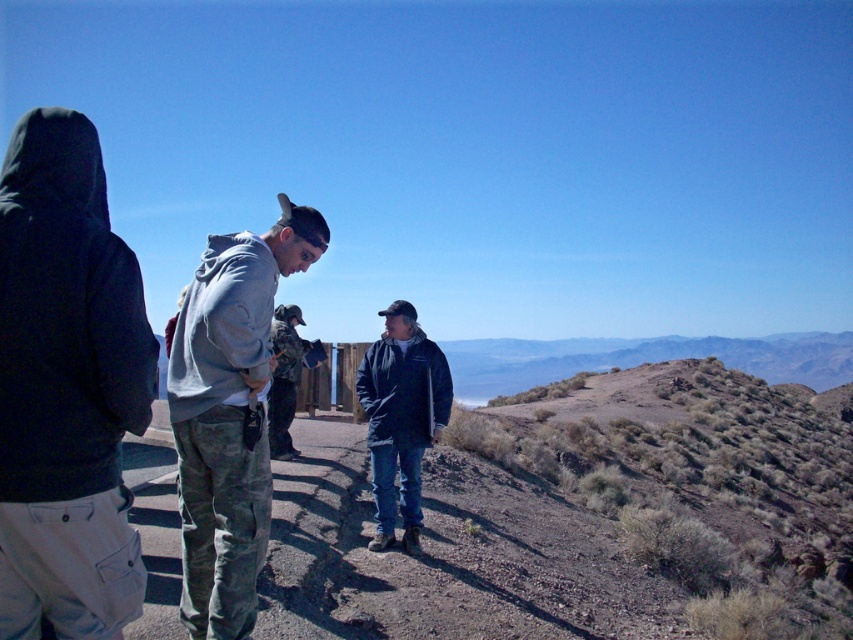
Question: Which point is closer to the camera?

Choices:
 (A) (401, 461)
 (B) (407, 353)
 (C) (149, 396)
 (D) (239, 260)

Answer: (C)

Question: Observing the image, what is the correct spatial positioning of camouflage pants at center in reference to camouflage jacket at center?

Choices:
 (A) above
 (B) below

Answer: (A)

Question: Can you confirm if camouflage pants at center is smaller than gray fleece sweatshirt at center?

Choices:
 (A) yes
 (B) no

Answer: (A)

Question: Which of the following is the closest to the observer?

Choices:
 (A) camouflage jacket at center
 (B) dark blue fleece jacket at center
 (C) dark blue jacket at center
 (D) camouflage pants at center

Answer: (D)

Question: Which object appears farthest from the camera in this image?

Choices:
 (A) dark blue fleece jacket at center
 (B) dark blue hoodie at left
 (C) gray fleece sweatshirt at center
 (D) camouflage pants at center

Answer: (A)

Question: Does gray fleece sweatshirt at center have a greater width compared to dark blue fleece jacket at center?

Choices:
 (A) no
 (B) yes

Answer: (A)